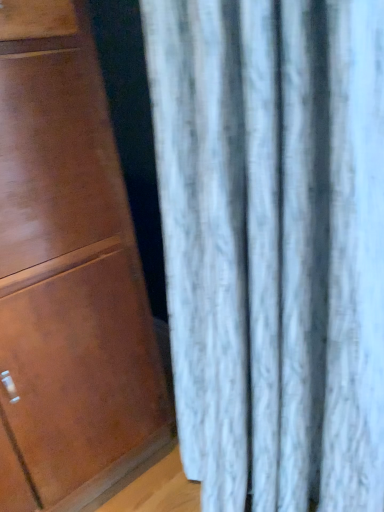
At what (x,y) coordinates should I click in order to perform the action: click on matte wood cupboard at left. Please return your answer as a coordinate pair (x, y). The height and width of the screenshot is (512, 384). Looking at the image, I should click on (67, 276).

Describe the element at coordinates (67, 276) in the screenshot. I see `matte wood cupboard at left` at that location.

The height and width of the screenshot is (512, 384). I want to click on matte wood cupboard at left, so click(67, 276).